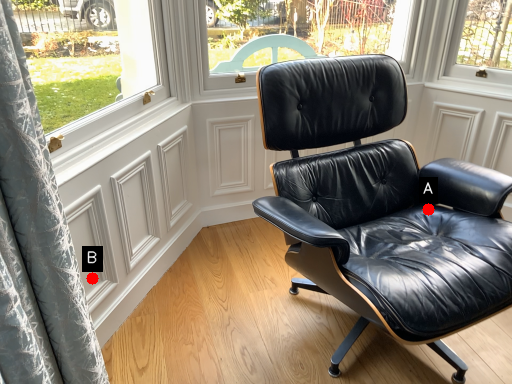
Question: Two points are circled on the image, labeled by A and B beside each circle. Which point is further to the camera?

Choices:
 (A) A is further
 (B) B is further

Answer: (A)